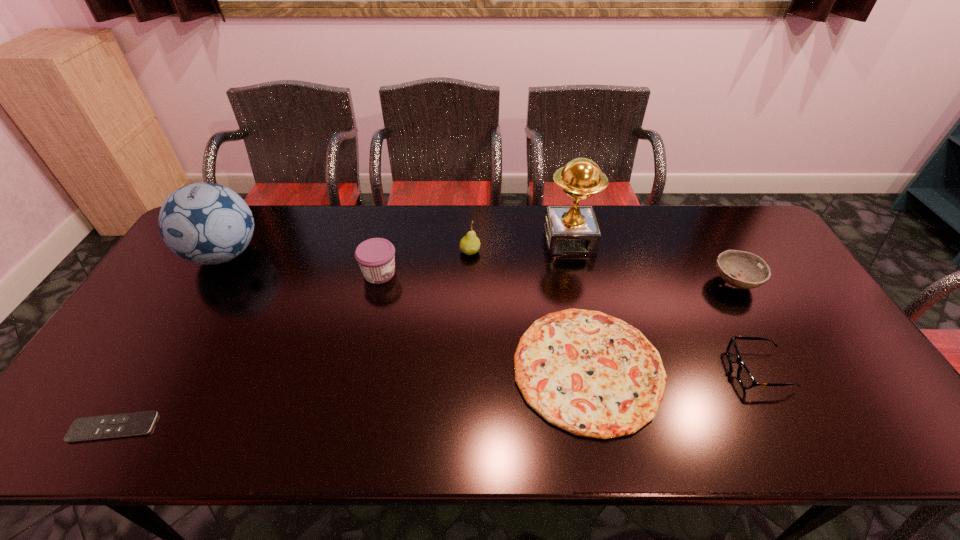
This screenshot has height=540, width=960. In order to click on free space at the left edge of the desktop in this screenshot , I will do coord(180,296).

Find the location of a particular element. The height and width of the screenshot is (540, 960). vacant space at the right edge is located at coordinates (x=774, y=318).

This screenshot has width=960, height=540. What are the coordinates of `vacant space at the far right corner of the desktop` in the screenshot? It's located at click(721, 209).

Locate an element on the screen. This screenshot has height=540, width=960. vacant point at the near right corner is located at coordinates (873, 441).

You are a GUI agent. You are given a task and a screenshot of the screen. Output one action in this format:
    pyautogui.click(x=<x>, y=<y>)
    Task: Click on the free space between the pizza and the seventh shortest object
    
    Given the screenshot: What is the action you would take?
    pyautogui.click(x=406, y=312)

This screenshot has width=960, height=540. Find the location of `empty location between the jam and the soccer ball`. empty location between the jam and the soccer ball is located at coordinates (302, 264).

At what (x,y) coordinates should I click in order to perform the action: click on free point between the soccer ball and the remote control. Please return your answer as a coordinate pair (x, y). Image resolution: width=960 pixels, height=540 pixels. Looking at the image, I should click on (169, 341).

You are a GUI agent. You are given a task and a screenshot of the screen. Output one action in this format:
    pyautogui.click(x=<x>, y=<y>)
    Task: Click on the free space between the sunglasses and the fifth tallest object
    
    Given the screenshot: What is the action you would take?
    pyautogui.click(x=746, y=326)

This screenshot has width=960, height=540. Identify the location of vacant region between the pizza and the award. (579, 304).

In order to click on free spot between the tallest object and the seventh shortest object in this screenshot , I will do `click(397, 247)`.